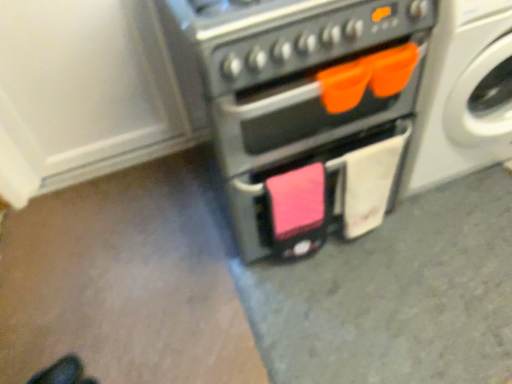
Measure the distance between point (456, 68) and camera.

They are 1.21 meters apart.

Image resolution: width=512 pixels, height=384 pixels. In order to click on white glossy washing machine at upper right in this screenshot , I will do `click(462, 95)`.

Where is `black leather shoes at lower left`? The width and height of the screenshot is (512, 384). black leather shoes at lower left is located at coordinates (63, 372).

The height and width of the screenshot is (384, 512). I want to click on matte black oven at center, so click(x=306, y=98).

Looking at this image, would you say black leather shoes at lower left is inside or outside white glossy washing machine at upper right?

black leather shoes at lower left is spatially situated outside white glossy washing machine at upper right.

Does black leather shoes at lower left touch white glossy washing machine at upper right?

No, black leather shoes at lower left is not making contact with white glossy washing machine at upper right.

From a real-world perspective, is black leather shoes at lower left physically below white glossy washing machine at upper right?

Yes, from a real-world perspective, black leather shoes at lower left is under white glossy washing machine at upper right.

Considering the positions of point (197, 12) and point (48, 367), is point (197, 12) closer or farther from the camera than point (48, 367)?

Point (197, 12) appears to be closer to the viewer than point (48, 367).

Considering the sizes of matte black oven at center and black leather shoes at lower left in the image, is matte black oven at center wider or thinner than black leather shoes at lower left?

In the image, matte black oven at center appears to be wider than black leather shoes at lower left.

From the image's perspective, would you say matte black oven at center is positioned over black leather shoes at lower left?

Correct, matte black oven at center appears higher than black leather shoes at lower left in the image.

How different are the orientations of matte black oven at center and black leather shoes at lower left in degrees?

The angular difference between matte black oven at center and black leather shoes at lower left is 40.4 degrees.

Is point (352, 183) positioned before point (456, 91)?

No, (352, 183) is behind (456, 91).

This screenshot has width=512, height=384. I want to click on home appliance located above the white glossy washing machine at upper right (from a real-world perspective), so click(x=306, y=98).

Consider the image. Considering the relative positions of matte black oven at center and white glossy washing machine at upper right in the image provided, is matte black oven at center in front of white glossy washing machine at upper right?

Yes, matte black oven at center is closer to the camera.

Measure the distance between matte black oven at center and white glossy washing machine at upper right.

The distance of matte black oven at center from white glossy washing machine at upper right is 11.23 inches.

Is the depth of white glossy washing machine at upper right less than that of black leather shoes at lower left?

Yes, white glossy washing machine at upper right is in front of black leather shoes at lower left.

Where is `footwear located underneath the white glossy washing machine at upper right (from a real-world perspective)`? The width and height of the screenshot is (512, 384). footwear located underneath the white glossy washing machine at upper right (from a real-world perspective) is located at coordinates (63, 372).

Is white glossy washing machine at upper right looking in the opposite direction of black leather shoes at lower left?

No, black leather shoes at lower left is not at the back of white glossy washing machine at upper right.

Considering the sizes of white glossy washing machine at upper right and black leather shoes at lower left in the image, is white glossy washing machine at upper right bigger or smaller than black leather shoes at lower left?

Considering their sizes, white glossy washing machine at upper right takes up more space than black leather shoes at lower left.

Which of these two, black leather shoes at lower left or matte black oven at center, is wider?

Answer: Wider between the two is matte black oven at center.

Are black leather shoes at lower left and matte black oven at center located far from each other?

black leather shoes at lower left is positioned a significant distance from matte black oven at center.

Consider the image. From a real-world perspective, is black leather shoes at lower left on top of matte black oven at center?

Actually, black leather shoes at lower left is physically below matte black oven at center in the real world.

Considering the sizes of objects white glossy washing machine at upper right and matte black oven at center in the image provided, who is shorter, white glossy washing machine at upper right or matte black oven at center?

white glossy washing machine at upper right.

Is white glossy washing machine at upper right positioned with its back to matte black oven at center?

No, white glossy washing machine at upper right's orientation is not away from matte black oven at center.

Is white glossy washing machine at upper right positioned before matte black oven at center?

No, it is not.

Does white glossy washing machine at upper right have a lesser width compared to matte black oven at center?

No.

Locate an element on the screen. washing machine on the right side of black leather shoes at lower left is located at coordinates (462, 95).

The height and width of the screenshot is (384, 512). What are the coordinates of `footwear located on the left of matte black oven at center` in the screenshot? It's located at (63, 372).

When comparing their distances from matte black oven at center, does black leather shoes at lower left or white glossy washing machine at upper right seem further?

Among the two, black leather shoes at lower left is located further to matte black oven at center.

Estimate the real-world distances between objects in this image. Which object is further from white glossy washing machine at upper right, matte black oven at center or black leather shoes at lower left?

Among the two, black leather shoes at lower left is located further to white glossy washing machine at upper right.

When comparing their distances from black leather shoes at lower left, does matte black oven at center or white glossy washing machine at upper right seem further?

Based on the image, white glossy washing machine at upper right appears to be further to black leather shoes at lower left.

In the scene shown: Considering their positions, is black leather shoes at lower left positioned closer to white glossy washing machine at upper right than matte black oven at center?

matte black oven at center lies closer to white glossy washing machine at upper right than the other object.

Which object lies further to the anchor point matte black oven at center, white glossy washing machine at upper right or black leather shoes at lower left?

black leather shoes at lower left lies further to matte black oven at center than the other object.

Based on their spatial positions, is white glossy washing machine at upper right or matte black oven at center further from black leather shoes at lower left?

white glossy washing machine at upper right.

The height and width of the screenshot is (384, 512). What are the coordinates of `home appliance situated between black leather shoes at lower left and white glossy washing machine at upper right from left to right` in the screenshot? It's located at pyautogui.click(x=306, y=98).